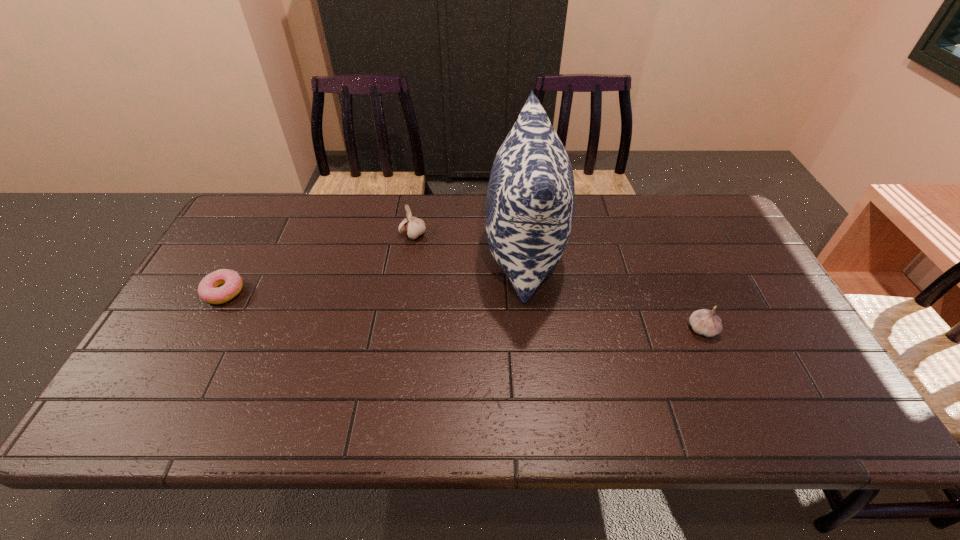
The image size is (960, 540). Identify the location of vacant space that is in between the doughnut and the tallest object. (374, 272).

Image resolution: width=960 pixels, height=540 pixels. Identify the location of free spot between the second object from right to left and the third object from right to left. (468, 244).

This screenshot has height=540, width=960. Find the location of `the second closest object to the nearer garlic`. the second closest object to the nearer garlic is located at coordinates pyautogui.click(x=414, y=227).

Locate an element on the screen. The image size is (960, 540). object that is the third closest to the farther garlic is located at coordinates pyautogui.click(x=705, y=322).

Where is `vacant region that satisfies the following two spatial constraints: 1. on the back side of the nearest object; 2. on the front surface of the cushion`? The width and height of the screenshot is (960, 540). vacant region that satisfies the following two spatial constraints: 1. on the back side of the nearest object; 2. on the front surface of the cushion is located at coordinates (668, 252).